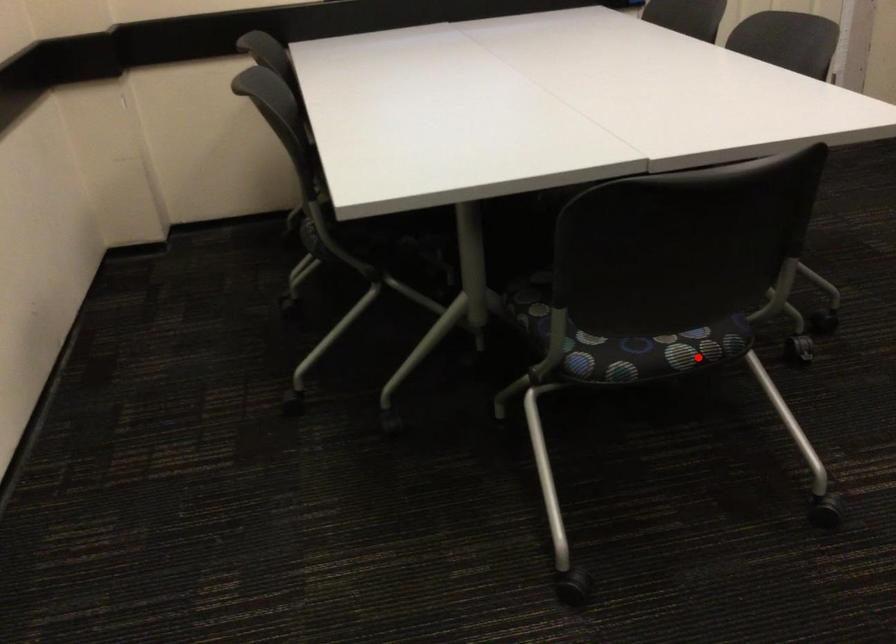
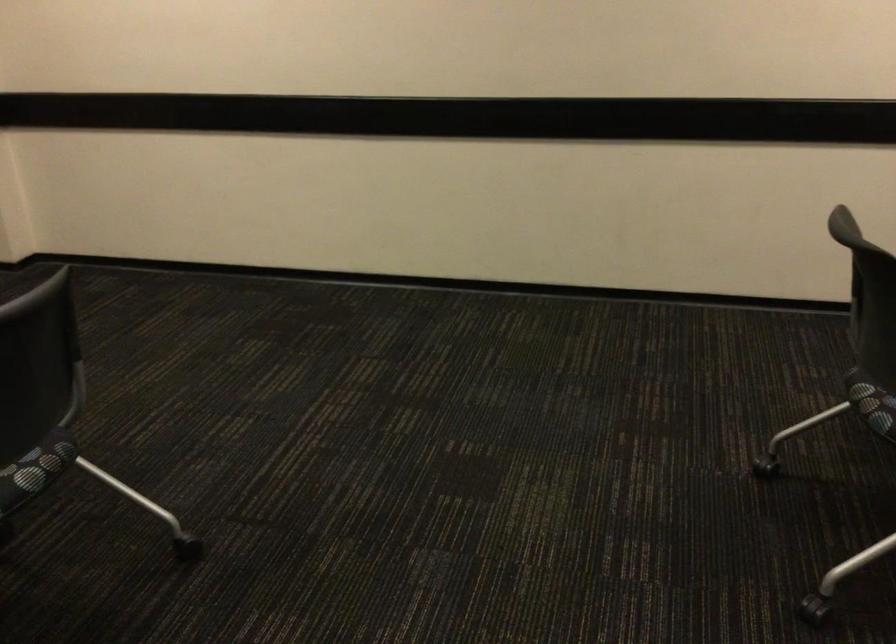
Question: A red point is marked in image1. In image2, is the corresponding 3D point closer to the camera or farther? Reply with the corresponding letter.

Choices:
 (A) The corresponding 3D point is closer.
 (B) The corresponding 3D point is farther.

Answer: (B)